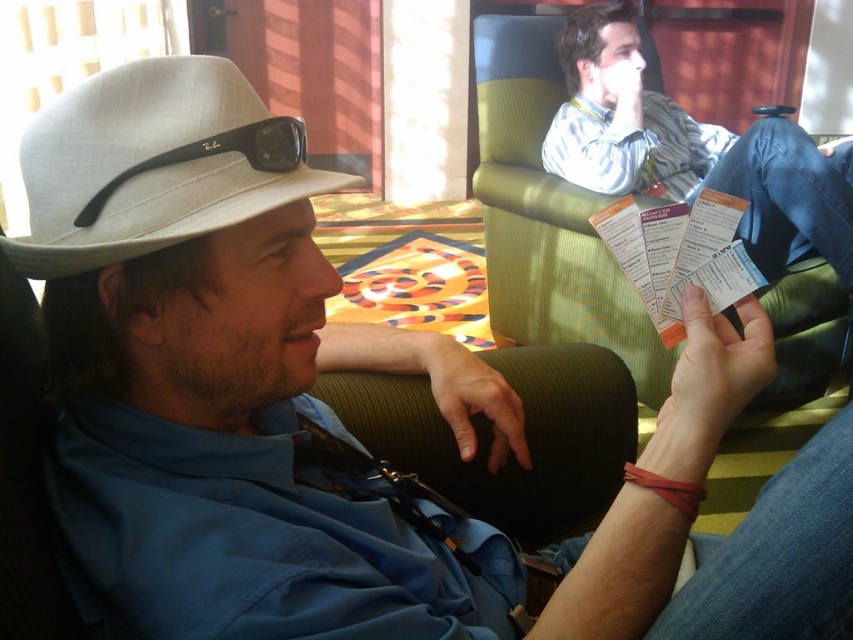
Question: Which point is closer to the camera taking this photo?

Choices:
 (A) (112, 99)
 (B) (566, 70)

Answer: (A)

Question: Does white fabric fedora at left lie in front of striped cotton shirt at upper right?

Choices:
 (A) yes
 (B) no

Answer: (A)

Question: Where is striped cotton shirt at upper right located in relation to matte black sunglasses at upper left in the image?

Choices:
 (A) left
 (B) right

Answer: (B)

Question: Can you confirm if white fabric fedora at left is positioned to the right of striped cotton shirt at upper right?

Choices:
 (A) no
 (B) yes

Answer: (A)

Question: Which of these objects is positioned closest to the matte black sunglasses at upper left?

Choices:
 (A) white fabric fedora at left
 (B) striped cotton shirt at upper right

Answer: (A)

Question: Among these points, which one is nearest to the camera?

Choices:
 (A) (601, 163)
 (B) (143, 163)

Answer: (B)